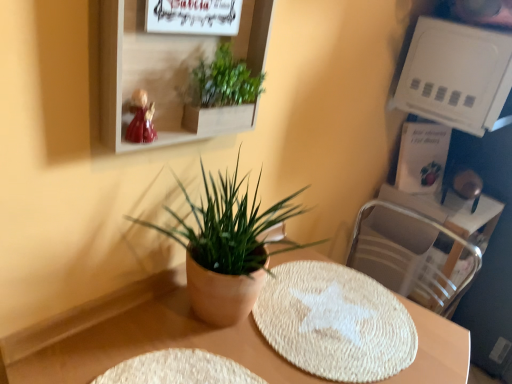
At what (x,y) coordinates should I click in order to perform the action: click on blank space situated above white woven mat at center (from a real-world perspective). Please return your answer as a coordinate pair (x, y). The height and width of the screenshot is (384, 512). Looking at the image, I should click on (334, 312).